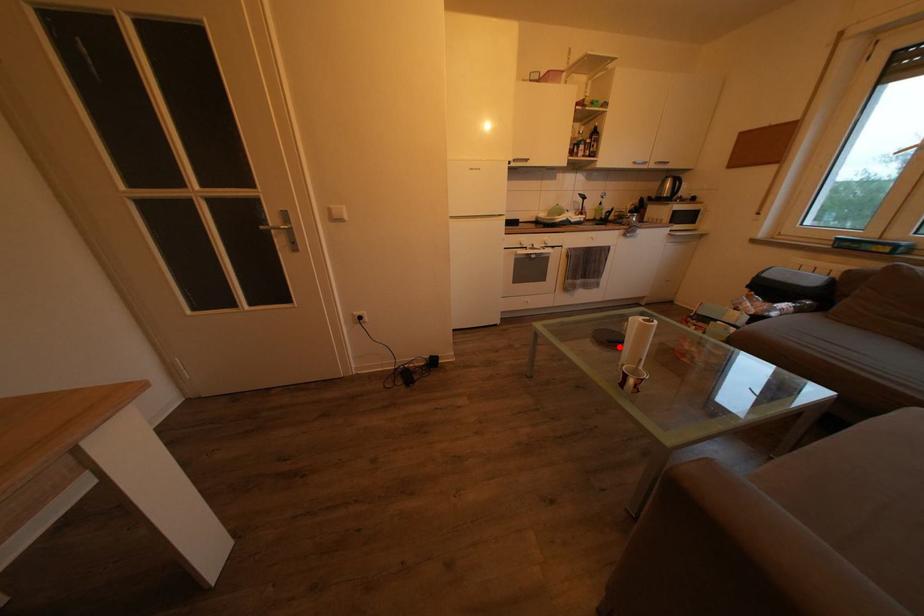
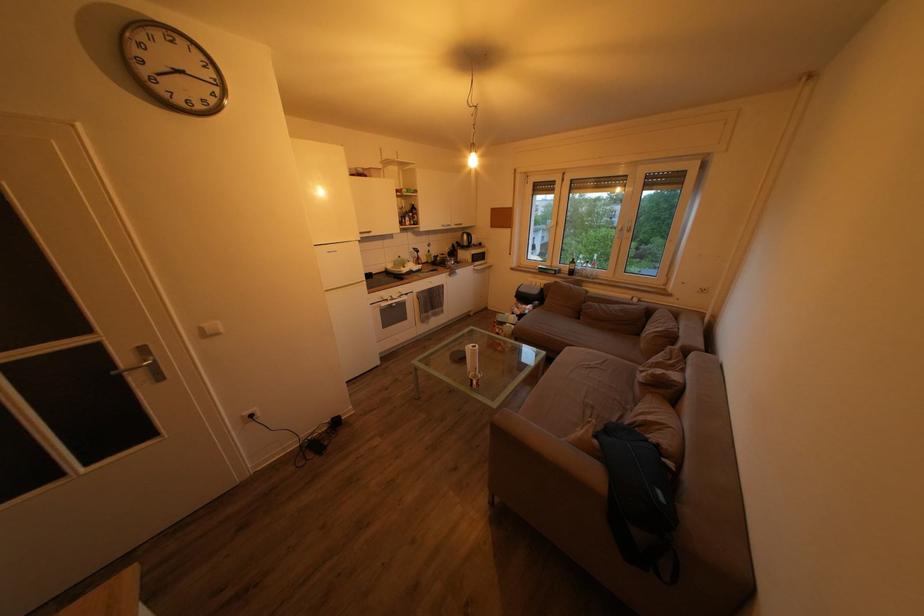
Question: I am providing you with two images of the same scene from different viewpoints. A red point is marked on the first image. Is the red point's position out of view in image 2?

Choices:
 (A) Yes
 (B) No

Answer: (B)